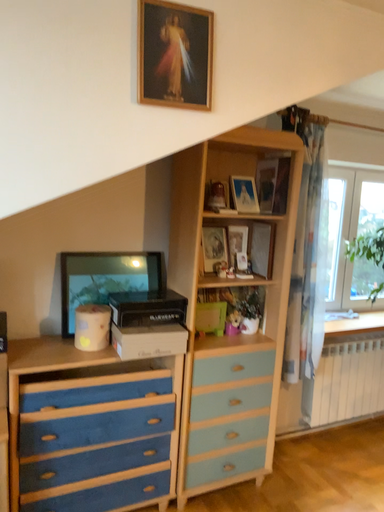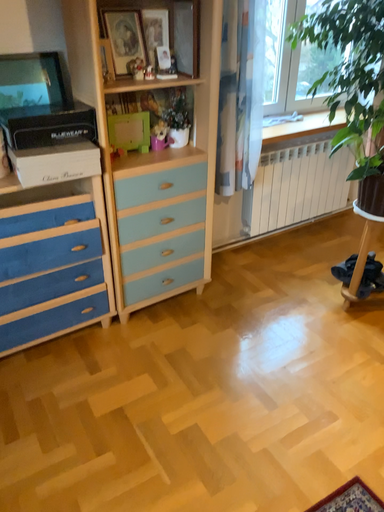
Question: How did the camera likely rotate when shooting the video?

Choices:
 (A) rotated upward
 (B) rotated downward

Answer: (B)